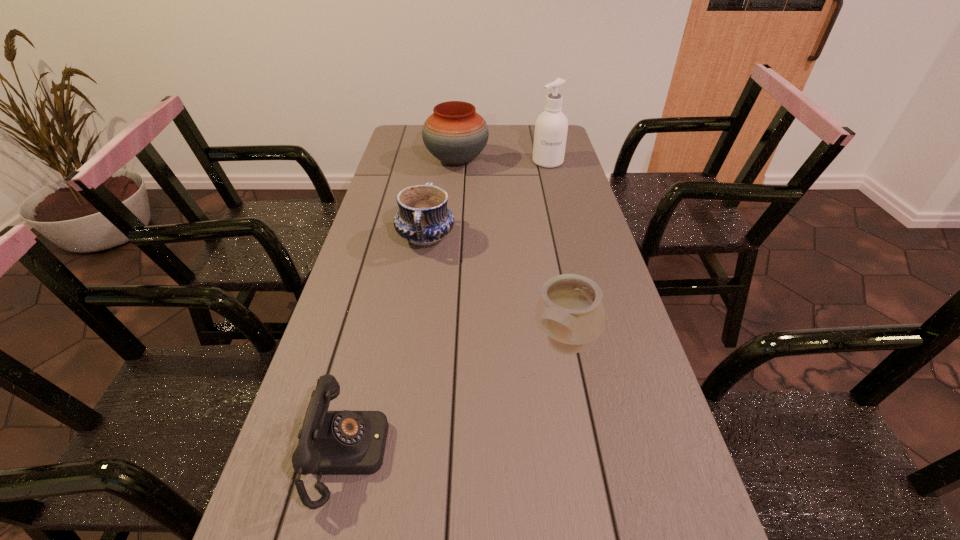
In the image, there is a desktop. At what (x,y) coordinates should I click in order to perform the action: click on vacant space at the far left corner. Please return your answer as a coordinate pair (x, y). The width and height of the screenshot is (960, 540). Looking at the image, I should click on (402, 136).

Where is `free spot between the cleansing agent and the farthest pottery`? This screenshot has height=540, width=960. free spot between the cleansing agent and the farthest pottery is located at coordinates (502, 161).

The height and width of the screenshot is (540, 960). Find the location of `blank region between the tallest object and the farthest pottery`. blank region between the tallest object and the farthest pottery is located at coordinates (502, 161).

What are the coordinates of `vacant point located between the shortest object and the rightmost pottery` in the screenshot? It's located at (457, 400).

Find the location of a particular element. free space that is in between the farthest pottery and the nearest pottery is located at coordinates (511, 253).

Where is `unoccupied position between the rightmost pottery and the farthest pottery`? The image size is (960, 540). unoccupied position between the rightmost pottery and the farthest pottery is located at coordinates (511, 253).

Locate an element on the screen. blank region between the nearest pottery and the second nearest pottery is located at coordinates (495, 292).

Find the location of a particular element. This screenshot has height=540, width=960. free space between the fourth farthest object and the second nearest pottery is located at coordinates (495, 292).

At what (x,y) coordinates should I click in order to perform the action: click on free space between the fourth tallest object and the nearest object. Please return your answer as a coordinate pair (x, y). Looking at the image, I should click on (387, 346).

Where is `vacant space that's between the nearest object and the third farthest object`? vacant space that's between the nearest object and the third farthest object is located at coordinates (387, 346).